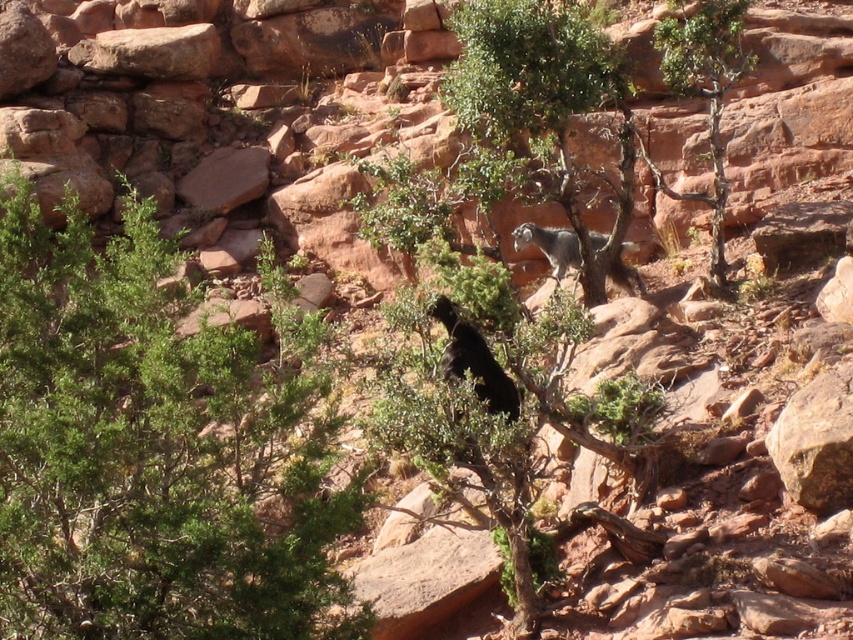
The image size is (853, 640). Describe the element at coordinates (506, 410) in the screenshot. I see `green leafy shrub at center` at that location.

Does point (610, 401) come in front of point (524, 240)?

That is True.

Find the location of a particular element. green leafy shrub at center is located at coordinates (506, 410).

Who is positioned more to the left, green leafy shrub at left or green leafy tree at center?

From the viewer's perspective, green leafy shrub at left appears more on the left side.

Which is below, green leafy shrub at left or green leafy tree at center?

Positioned lower is green leafy shrub at left.

Is point (38, 262) positioned in front of point (521, 115)?

Yes, it is.

Identify the location of green leafy shrub at left. Image resolution: width=853 pixels, height=640 pixels. (154, 451).

Does green leafy tree at center have a larger size compared to green leafy tree at upper right?

No, green leafy tree at center is not bigger than green leafy tree at upper right.

What do you see at coordinates (538, 112) in the screenshot?
I see `green leafy tree at center` at bounding box center [538, 112].

Who is more forward, (521, 81) or (682, 13)?

Point (521, 81) is more forward.

At what (x,y) coordinates should I click in order to perform the action: click on green leafy tree at center. Please return your answer as a coordinate pair (x, y). The image size is (853, 640). Looking at the image, I should click on (538, 112).